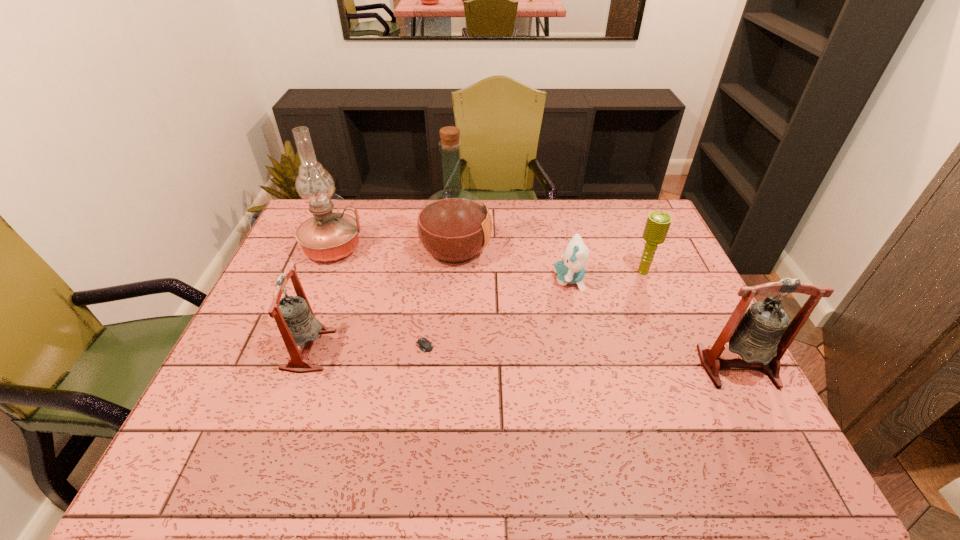
Locate an element on the screen. The height and width of the screenshot is (540, 960). oil lamp present at the far edge is located at coordinates (328, 236).

At what (x,y) coordinates should I click in order to perform the action: click on liquor that is positioned at the far edge. Please return your answer as a coordinate pair (x, y). Looking at the image, I should click on (453, 225).

Locate an element on the screen. bell that is at the left edge is located at coordinates (297, 324).

Find the location of a particular element. oil lamp that is at the left edge is located at coordinates (328, 236).

What are the coordinates of `bell at the right edge` in the screenshot? It's located at (761, 335).

Image resolution: width=960 pixels, height=540 pixels. I want to click on microphone that is at the right edge, so click(657, 225).

Where is `object that is at the far left corner`? The height and width of the screenshot is (540, 960). object that is at the far left corner is located at coordinates (328, 236).

The height and width of the screenshot is (540, 960). What are the coordinates of `vacant space at the far edge of the desktop` in the screenshot? It's located at (396, 220).

This screenshot has height=540, width=960. In the image, there is a desktop. In order to click on blank space at the near edge in this screenshot , I will do `click(615, 400)`.

What are the coordinates of `vacant space at the left edge of the desktop` in the screenshot? It's located at (283, 373).